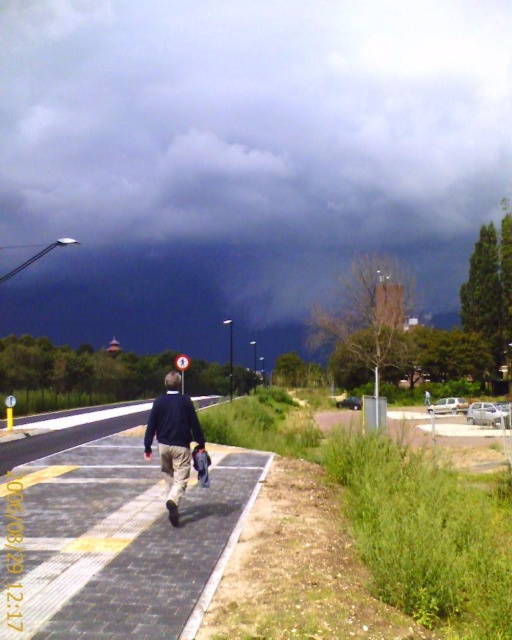
Does point (44, 275) lie in front of point (199, 500)?

No, (44, 275) is behind (199, 500).

Can you confirm if dark gray cloud at upper center is bigger than black asphalt pavement at center?

Yes, dark gray cloud at upper center is bigger than black asphalt pavement at center.

What do you see at coordinates (243, 157) in the screenshot?
I see `dark gray cloud at upper center` at bounding box center [243, 157].

What are the coordinates of `dark gray cloud at upper center` in the screenshot? It's located at (243, 157).

Does point (130, 616) come in front of point (198, 432)?

That is True.

Which is behind, point (174, 529) or point (156, 410)?

The point (156, 410) is behind.

Measure the distance between point (23, 595) and camera.

Point (23, 595) is 5.94 meters from camera.

This screenshot has width=512, height=640. In order to click on black asphalt pavement at center in this screenshot , I will do `click(112, 540)`.

Is dark gray cloud at upper center to the left of dark blue sweater at center from the viewer's perspective?

No, dark gray cloud at upper center is not to the left of dark blue sweater at center.

Can you confirm if dark gray cloud at upper center is positioned to the right of dark blue sweater at center?

Yes, dark gray cloud at upper center is to the right of dark blue sweater at center.

This screenshot has width=512, height=640. What do you see at coordinates (243, 157) in the screenshot?
I see `dark gray cloud at upper center` at bounding box center [243, 157].

What are the coordinates of `dark gray cloud at upper center` in the screenshot? It's located at (243, 157).